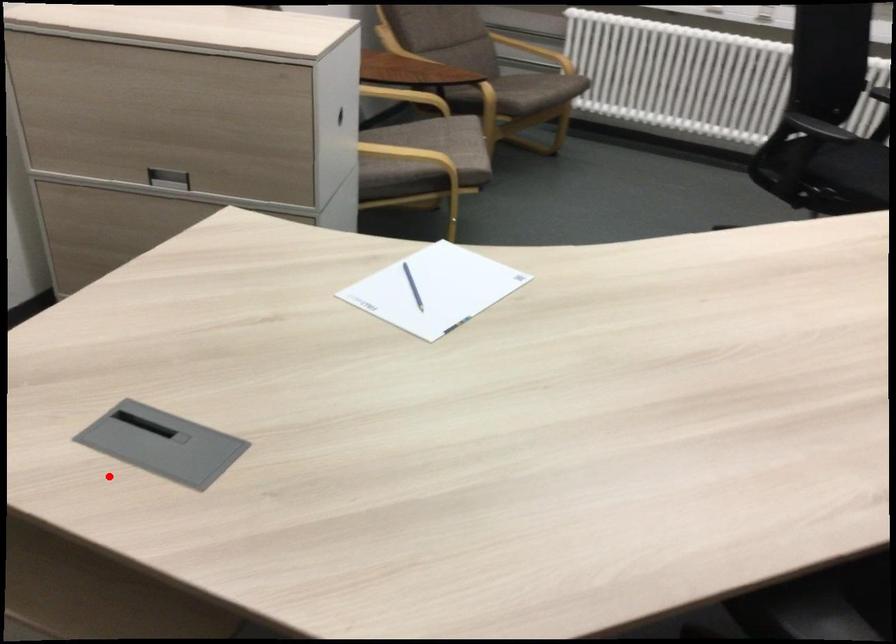
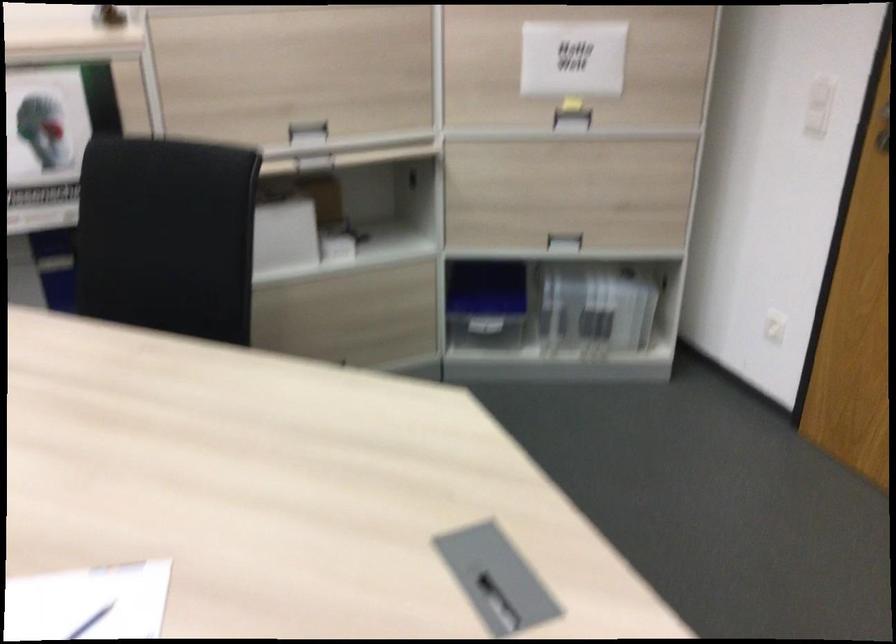
In the second image, find the point that corresponds to the highlighted location in the first image.

(497, 603)